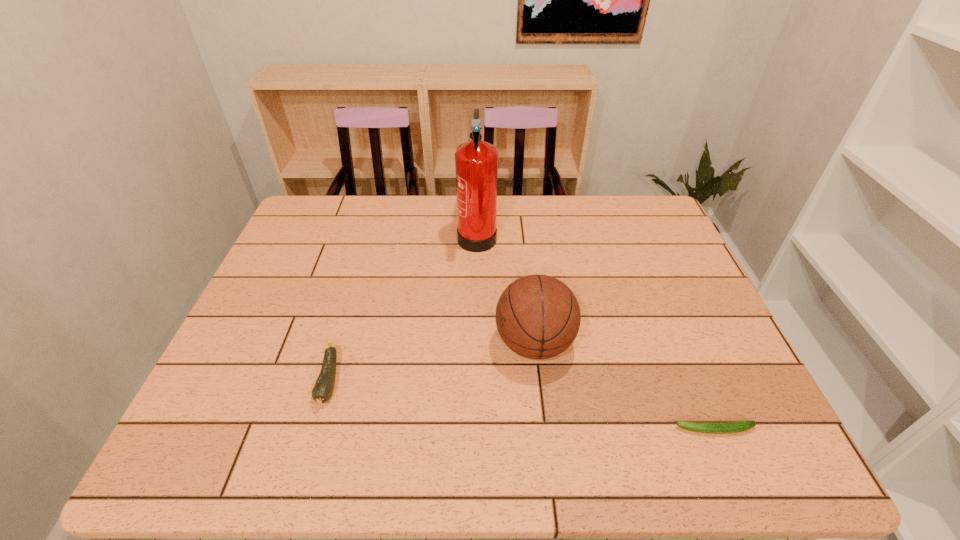
Find the location of `empty space between the shortest object and the farthest object`. empty space between the shortest object and the farthest object is located at coordinates (596, 332).

Where is `vacant space that is in between the farthest object and the second tallest object`? The image size is (960, 540). vacant space that is in between the farthest object and the second tallest object is located at coordinates (506, 288).

Identify the location of free space between the tallest object and the left zucchini. (403, 307).

I want to click on empty space between the nearest object and the third shortest object, so click(625, 387).

At what (x,y) coordinates should I click in order to perform the action: click on object identified as the closest to the farthest object. Please return your answer as a coordinate pair (x, y). Looking at the image, I should click on (537, 316).

The height and width of the screenshot is (540, 960). In order to click on object that stands as the third closest to the left zucchini in this screenshot , I will do `click(740, 426)`.

The height and width of the screenshot is (540, 960). I want to click on free space in the image that satisfies the following two spatial constraints: 1. on the side with brand label of the basketball; 2. at the blossom end of the taller zucchini, so click(539, 380).

Image resolution: width=960 pixels, height=540 pixels. I want to click on free spot that satisfies the following two spatial constraints: 1. on the side with brand label of the basketball; 2. at the blossom end of the third tallest object, so click(539, 380).

You are a GUI agent. You are given a task and a screenshot of the screen. Output one action in this format:
    pyautogui.click(x=<x>, y=<y>)
    Task: Click on the free space in the image that satisfies the following two spatial constraints: 1. on the side with brand label of the second tallest object; 2. at the blossom end of the leftmost object
    The height and width of the screenshot is (540, 960).
    Given the screenshot: What is the action you would take?
    pyautogui.click(x=539, y=380)